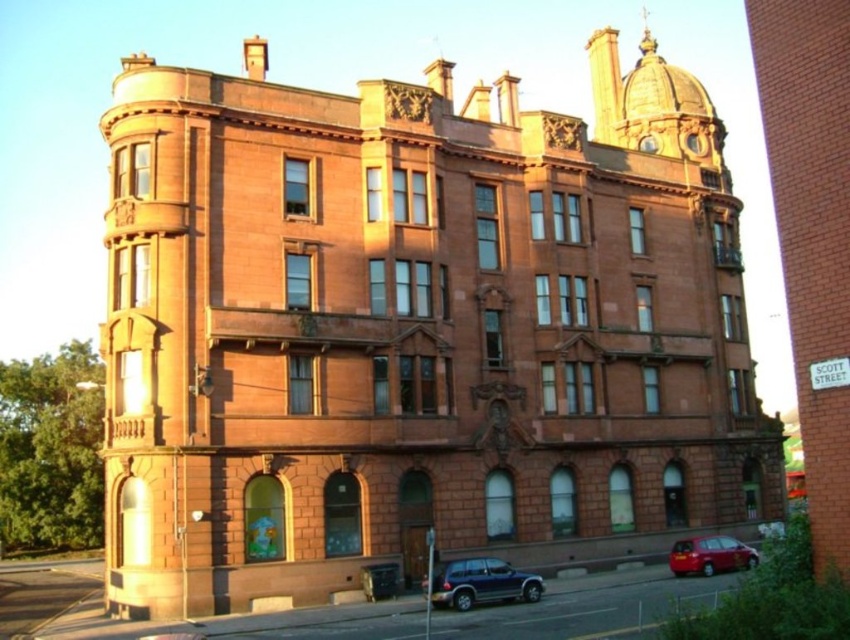
You are a delivery driver who needs to park your vehicle, a satin black suv at lower center, in a parking spot located at coordinates 0.912, 0.567. Is your current position aligned with the parking spot?

The satin black suv at lower center is positioned exactly at point (480, 582), so it is already aligned with the parking spot.

You are a delivery driver who needs to park your vehicle between two cars. The parking spot is exactly the size of the shiny red car at lower right. Can you park your satin black suv at lower center in this spot?

The satin black suv at lower center is wider than the shiny red car at lower right, so it cannot fit into the parking spot designed for the shiny red car at lower right.

You are a tour guide explaining the historical building to visitors. You notice a satin black suv at lower center and a shiny red car at lower right. Which car is closer to the left side of the image?

The satin black suv at lower center is positioned on the left side of the shiny red car at lower right, so it is closer to the left side of the image.